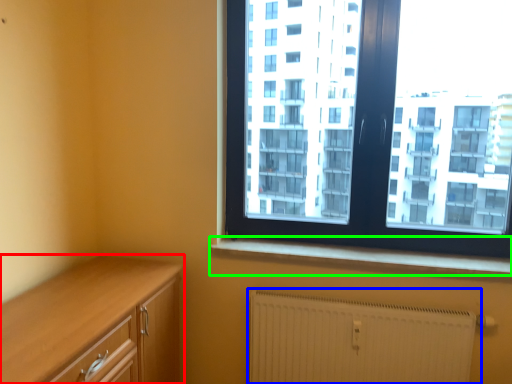
Question: Based on their relative distances, which object is nearer to cabinetry (highlighted by a red box)? Choose from radiator (highlighted by a blue box) and window sill (highlighted by a green box).

Choices:
 (A) radiator
 (B) window sill

Answer: (B)